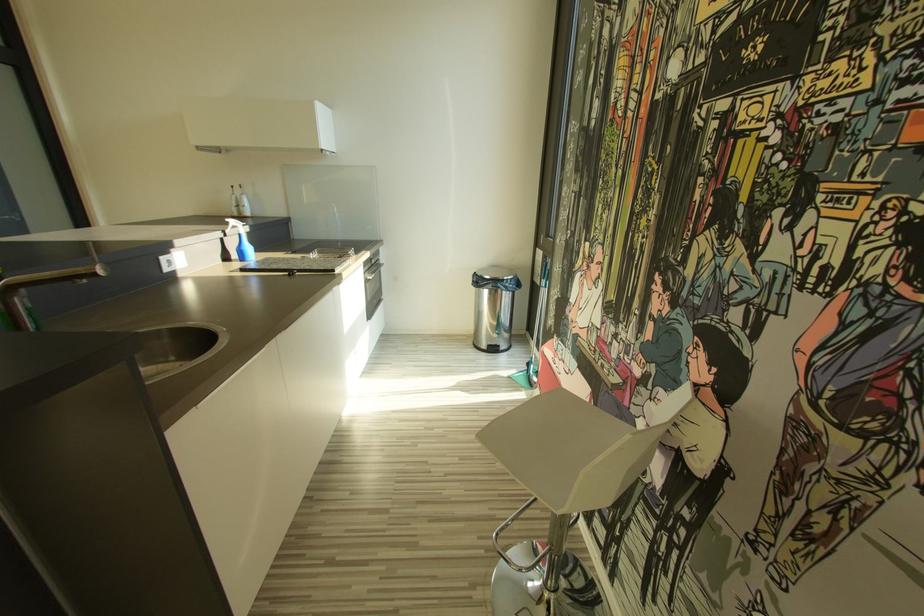
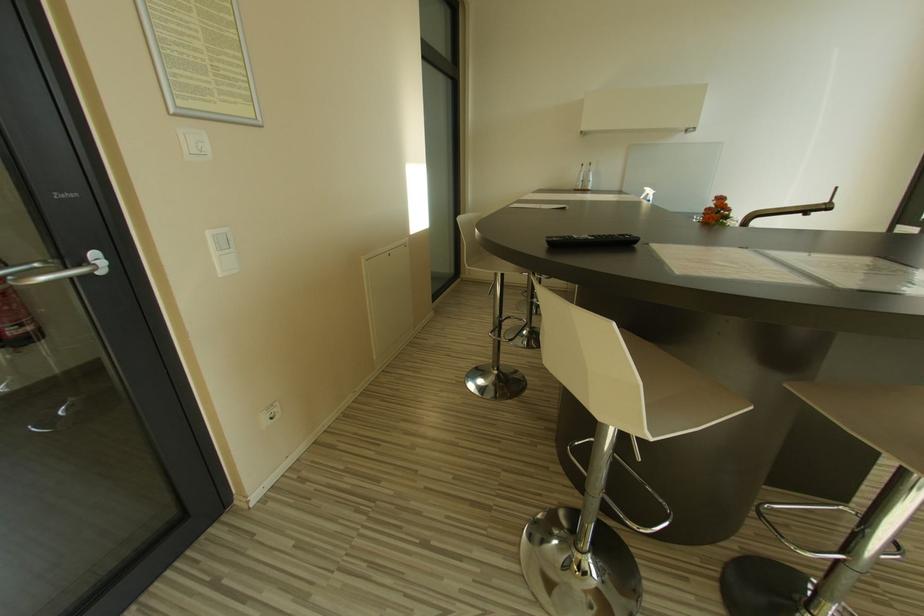
What movement of the cameraman would produce the second image?

The cameraman walked toward left, backward.